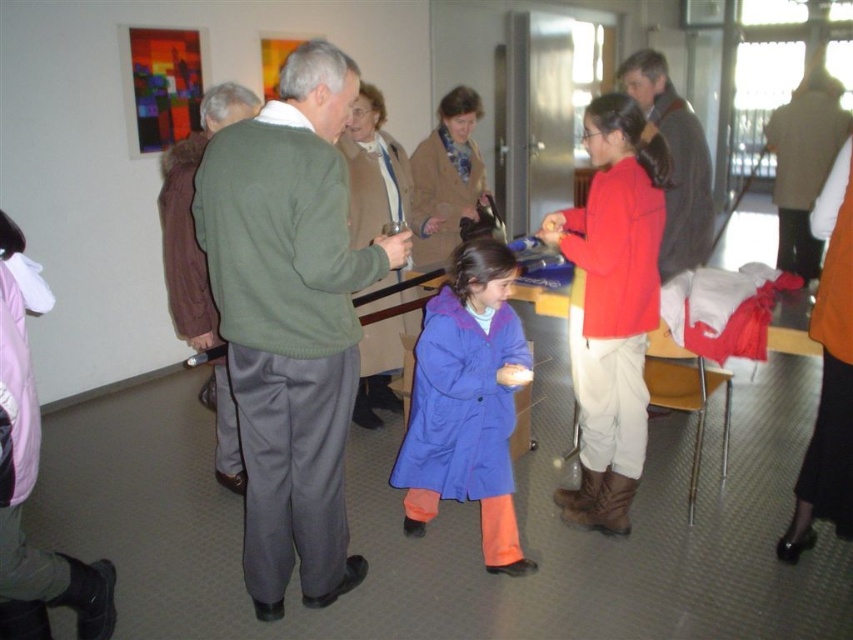
You are organizing a clothing donation drive and need to determine which item takes up less space. You have a green fabric jacket at center and a dark gray sweater at upper right. Which item should you choose to save space?

The green fabric jacket at center is thinner than the dark gray sweater at upper right, so it takes up less space and should be chosen to save space.

You are a photographer at the event and want to capture a photo of both the matte blue coat at center and the dark gray sweater at upper right. Which object should you focus on first to ensure both are in frame?

The matte blue coat at center is much taller than the dark gray sweater at upper right, so you should focus on the matte blue coat at center first to ensure both fit within the frame.